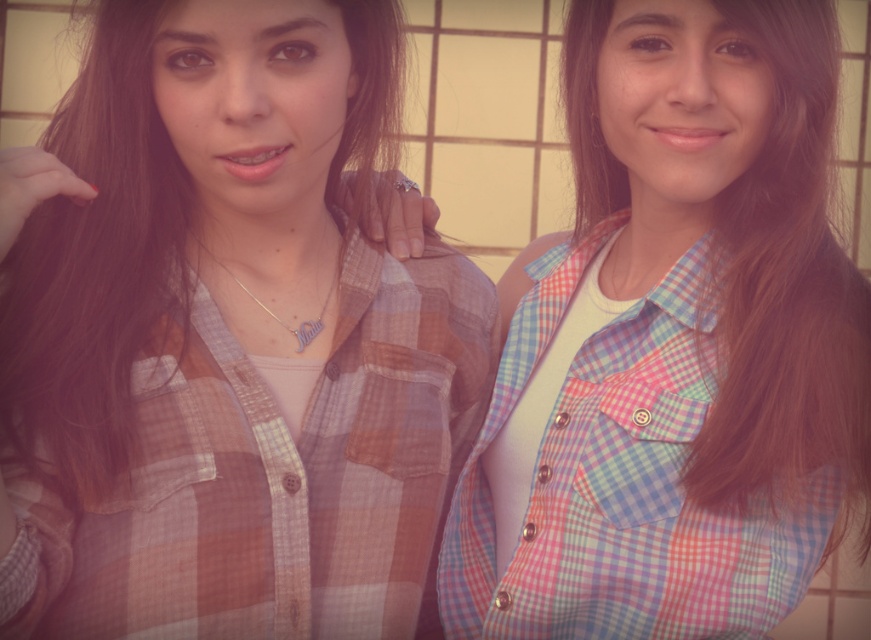
You are a photographer trying to capture a closeup of both the brown silky hair at center and the brownsmoothhair at left. Which hair should you focus on first to ensure it appears larger in the photo?

The brown silky hair at center should be focused on first because it has a larger size compared to the brownsmoothhair at left, ensuring it appears prominent in the photo.

You are standing at the point marked by the coordinates point (863, 552) and want to take a photo of the scene. The photographer is currently 4.63 feet away from you. Is the photographer close enough to capture both people in the frame without zooming in?

The photographer is 4.63 feet away from point (863, 552), so yes, they are close enough to capture both people in the frame without needing to zoom in.

You are taking a photo of two people with their hair in focus. You need to ensure that both the brown silky hair at center and the brownsmoothhair at left are visible in the frame. Based on their positions, which hair is closer to the right edge of the photo?

The brown silky hair at center is closer to the right edge of the photo because it is positioned on the right side of brownsmoothhair at left.